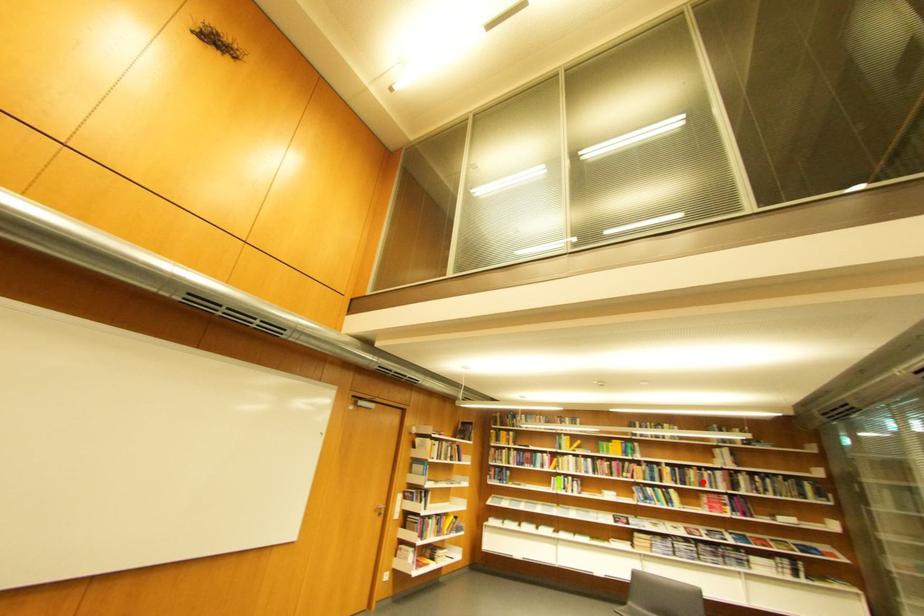
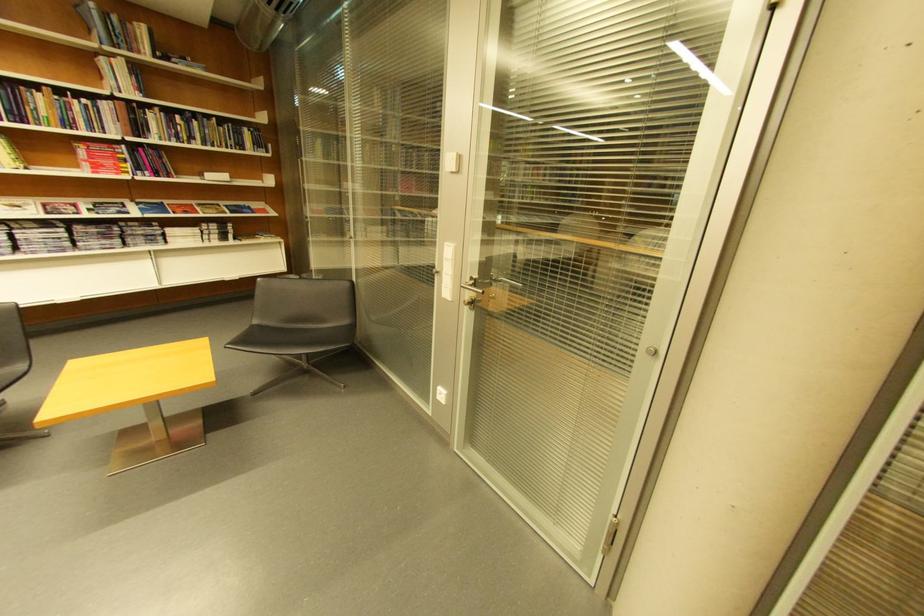
In the second image, find the point that corresponds to the highlighted location in the first image.

(54, 116)